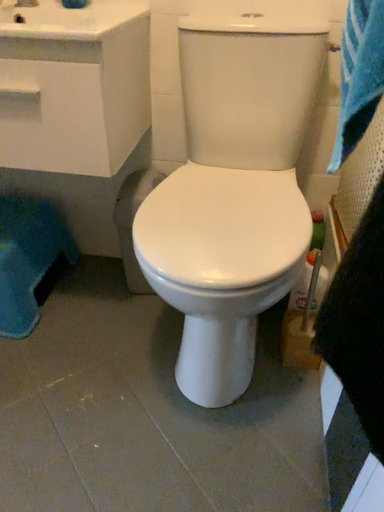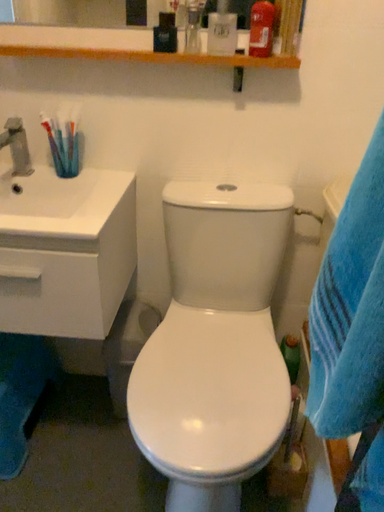
Question: Which way did the camera rotate in the video?

Choices:
 (A) rotated upward
 (B) rotated downward

Answer: (A)